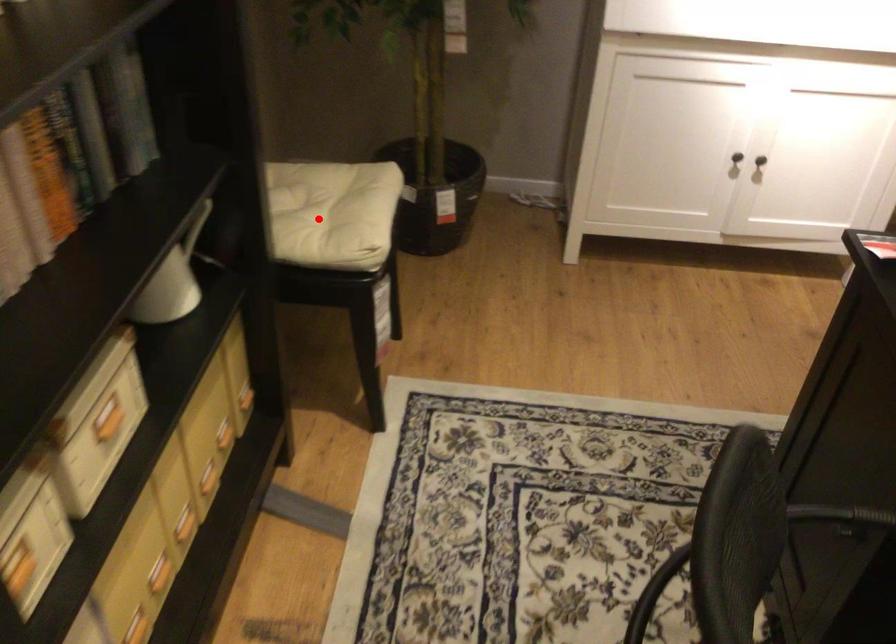
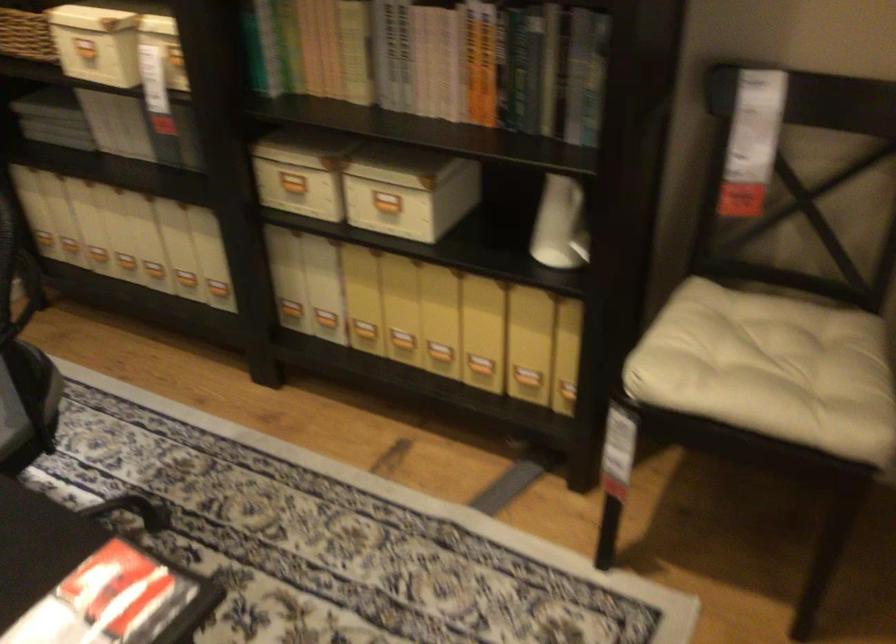
Question: A red point is marked in image1. In image2, is the corresponding 3D point closer to the camera or farther? Reply with the corresponding letter.

Choices:
 (A) The corresponding 3D point is closer.
 (B) The corresponding 3D point is farther.

Answer: (A)